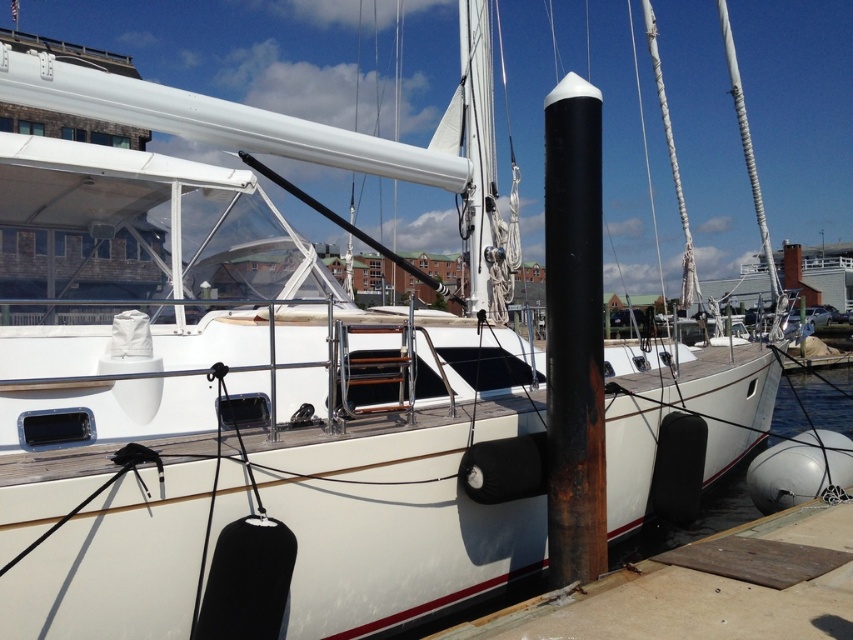
Does wooden at lower right have a lesser width compared to rusty metal pole at center?

Incorrect, wooden at lower right's width is not less than rusty metal pole at center's.

Between wooden at lower right and rusty metal pole at center, which one is positioned lower?

wooden at lower right is lower down.

Which is behind, point (648, 612) or point (567, 513)?

Positioned behind is point (567, 513).

At what (x,y) coordinates should I click in order to perform the action: click on wooden at lower right. Please return your answer as a coordinate pair (x, y). Image resolution: width=853 pixels, height=640 pixels. Looking at the image, I should click on (706, 588).